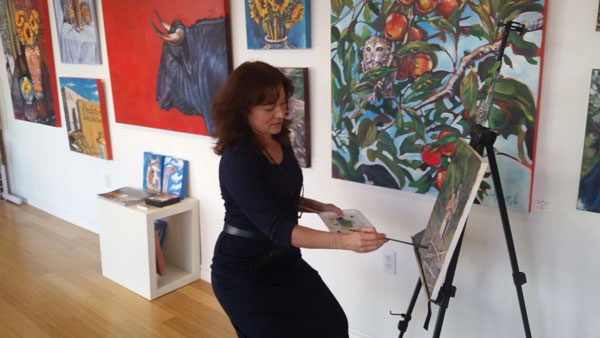
The height and width of the screenshot is (338, 600). Find the location of `painting`. painting is located at coordinates (398, 115), (187, 75), (283, 31), (300, 124), (445, 202), (34, 76), (90, 49), (87, 124), (583, 160).